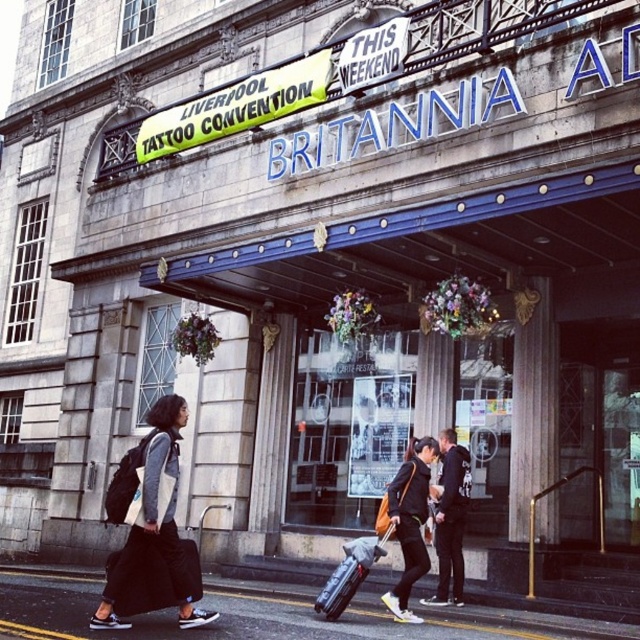
Does smooth asphalt pavement at lower center have a lesser width compared to dark gray jacket at center?

No.

Between smooth asphalt pavement at lower center and dark gray jacket at center, which one has more height?

smooth asphalt pavement at lower center

Does point (56, 596) come behind point (467, 484)?

No, (56, 596) is in front of (467, 484).

The image size is (640, 640). Identify the location of smooth asphalt pavement at lower center. (269, 618).

Who is more distant from viewer, (195, 570) or (346, 564)?

Point (346, 564)

Is point (132, 490) behind point (362, 550)?

That is False.

Find the location of a particular element. This screenshot has height=640, width=640. matte black backpack at left is located at coordinates (150, 531).

Is the position of matte black jacket at center less distant than that of dark gray jacket at center?

Yes, it is.

How far apart are matte black jacket at center and dark gray jacket at center?

matte black jacket at center and dark gray jacket at center are 10.18 feet apart.

Is point (412, 548) less distant than point (440, 436)?

Yes, it is in front of point (440, 436).

The height and width of the screenshot is (640, 640). What are the coordinates of `matte black jacket at center` in the screenshot? It's located at (410, 522).